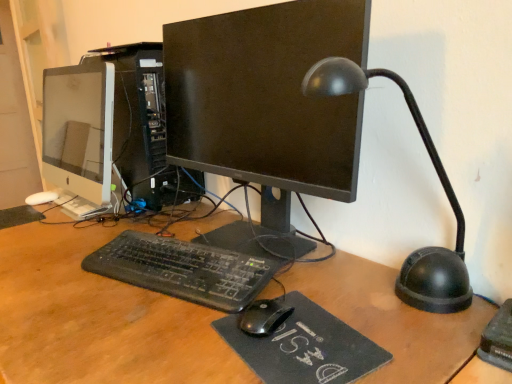
Locate an element on the screen. This screenshot has width=512, height=384. free space above black felt mousepad at center (from a real-world perspective) is located at coordinates (297, 326).